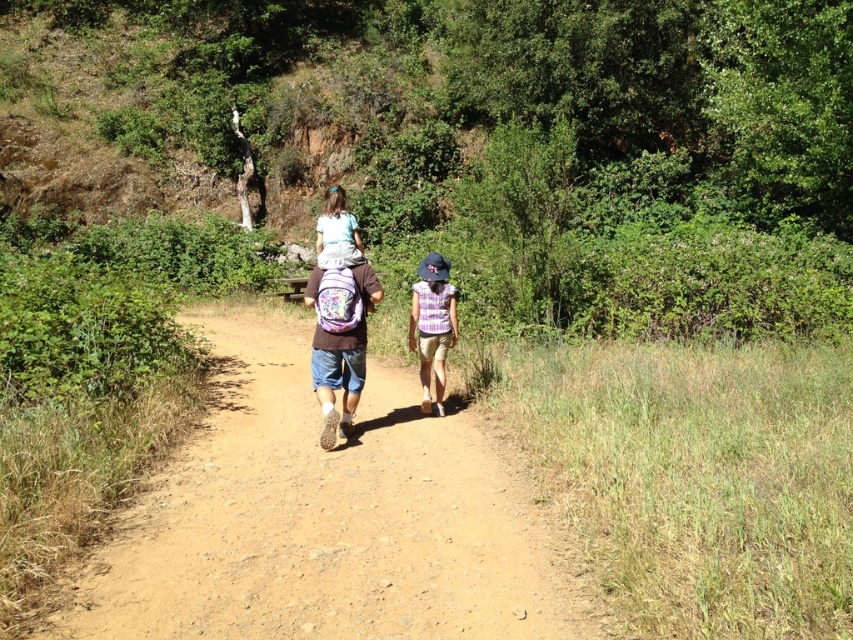
Question: Which of the following is the closest to the observer?

Choices:
 (A) brown dirt track at center
 (B) purple fabric backpack at center
 (C) purple striped shirt at center

Answer: (A)

Question: Can you confirm if brown dirt track at center is wider than purple fabric backpack at center?

Choices:
 (A) yes
 (B) no

Answer: (A)

Question: Which point is farther to the camera?

Choices:
 (A) (235, 556)
 (B) (360, 380)
 (C) (447, 308)

Answer: (C)

Question: Is purple fabric backpack at center further to camera compared to purple striped shirt at center?

Choices:
 (A) yes
 (B) no

Answer: (B)

Question: Which object is farther from the camera taking this photo?

Choices:
 (A) brown dirt track at center
 (B) purple striped shirt at center

Answer: (B)

Question: Does purple fabric backpack at center appear under purple striped shirt at center?

Choices:
 (A) yes
 (B) no

Answer: (A)